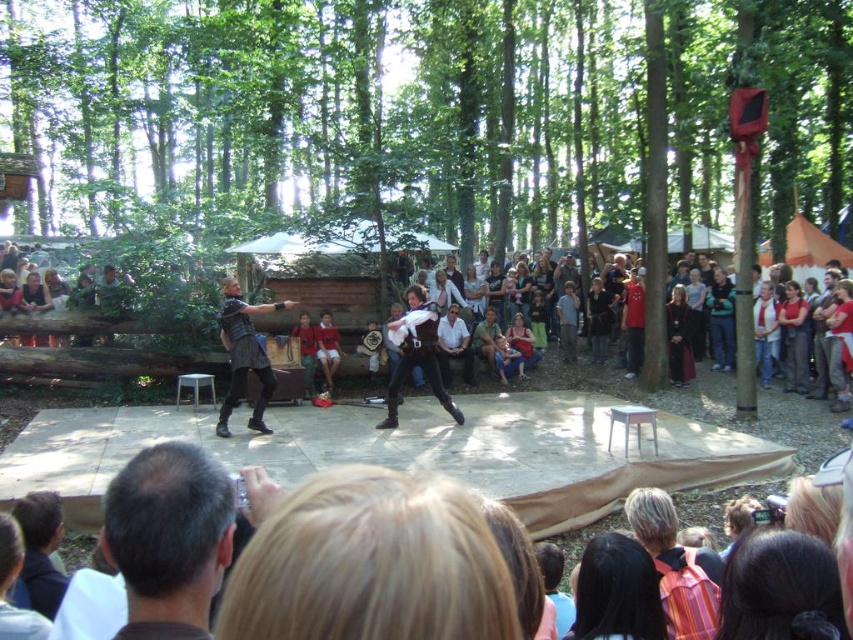
Who is higher up, dark blue shirt at right or light blue shirt at center?

Positioned higher is light blue shirt at center.

From the picture: Can you confirm if dark blue shirt at right is positioned to the right of light blue shirt at center?

Yes, dark blue shirt at right is to the right of light blue shirt at center.

Is point (795, 321) closer to camera compared to point (564, 326)?

Yes, it is.

The height and width of the screenshot is (640, 853). Find the location of `dark blue shirt at right`. dark blue shirt at right is located at coordinates (793, 337).

Does red striped shirt at center appear on the left side of denim jacket at center?

Incorrect, red striped shirt at center is not on the left side of denim jacket at center.

Can you confirm if red striped shirt at center is positioned to the right of denim jacket at center?

Yes, red striped shirt at center is to the right of denim jacket at center.

Measure the distance between red striped shirt at center and camera.

red striped shirt at center is 63.41 feet from camera.

The height and width of the screenshot is (640, 853). Identify the location of red striped shirt at center. (764, 332).

Between red striped shirt at center and red shirt at center, which one has more height?

red striped shirt at center

Is red striped shirt at center bigger than red shirt at center?

Yes, red striped shirt at center is bigger than red shirt at center.

Find the location of a particular element. The width and height of the screenshot is (853, 640). red striped shirt at center is located at coordinates (764, 332).